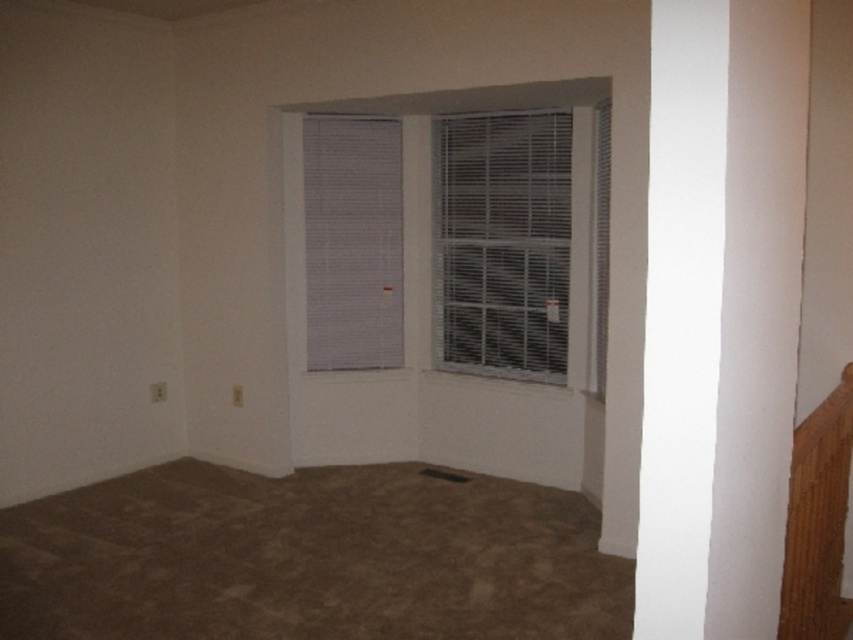
Can you confirm if white plastic blinds at center is shorter than white textured blind at center?

No, white plastic blinds at center is not shorter than white textured blind at center.

Is white plastic blinds at center wider than white textured blind at center?

Yes.

Find the location of `white plastic blinds at center`. white plastic blinds at center is located at coordinates (502, 243).

Does white textured blinds at upper center have a lesser height compared to white textured blind at center?

Yes.

Is white textured blinds at upper center closer to the viewer compared to white textured blind at center?

No, it is behind white textured blind at center.

Does point (369, 138) lie in front of point (608, 180)?

That is False.

Locate an element on the screen. This screenshot has height=640, width=853. white textured blinds at upper center is located at coordinates (352, 243).

Based on the photo, between white plastic blinds at center and white textured blinds at upper center, which one appears on the right side from the viewer's perspective?

From the viewer's perspective, white plastic blinds at center appears more on the right side.

Is point (502, 284) farther from camera compared to point (392, 234)?

No, it is in front of (392, 234).

Measure the distance between point (541, 358) and camera.

Point (541, 358) and camera are 4.38 meters apart.

Locate an element on the screen. Image resolution: width=853 pixels, height=640 pixels. white plastic blinds at center is located at coordinates (502, 243).